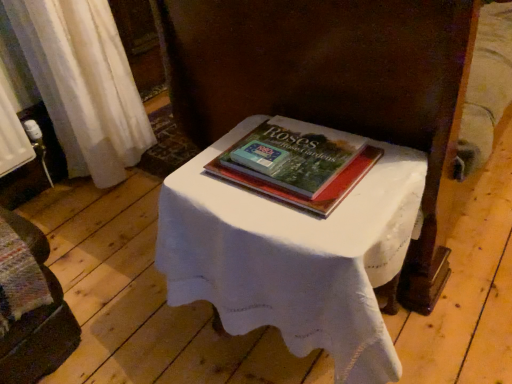
Question: Would you say wooden bench at lower left is a long distance from hardcover book at center?

Choices:
 (A) no
 (B) yes

Answer: (A)

Question: From a real-world perspective, is wooden bench at lower left over hardcover book at center?

Choices:
 (A) no
 (B) yes

Answer: (A)

Question: Could you tell me if wooden bench at lower left is turned towards hardcover book at center?

Choices:
 (A) yes
 (B) no

Answer: (B)

Question: Is wooden bench at lower left directly adjacent to hardcover book at center?

Choices:
 (A) yes
 (B) no

Answer: (B)

Question: Is hardcover book at center a part of wooden bench at lower left?

Choices:
 (A) yes
 (B) no

Answer: (B)

Question: Is hardcover book at center bigger or smaller than wooden bench at lower left?

Choices:
 (A) small
 (B) big

Answer: (A)

Question: In terms of height, does hardcover book at center look taller or shorter compared to wooden bench at lower left?

Choices:
 (A) short
 (B) tall

Answer: (A)

Question: Relative to wooden bench at lower left, is hardcover book at center in front or behind?

Choices:
 (A) behind
 (B) front

Answer: (A)

Question: Is point (335, 170) positioned closer to the camera than point (1, 238)?

Choices:
 (A) closer
 (B) farther

Answer: (A)

Question: In the image, is wooden bench at lower left on the left side or the right side of white cloth-covered table at center?

Choices:
 (A) left
 (B) right

Answer: (A)

Question: From the image's perspective, is wooden bench at lower left positioned above or below white cloth-covered table at center?

Choices:
 (A) below
 (B) above

Answer: (A)

Question: Considering the positions of wooden bench at lower left and white cloth-covered table at center in the image, is wooden bench at lower left bigger or smaller than white cloth-covered table at center?

Choices:
 (A) big
 (B) small

Answer: (B)

Question: Is point (28, 226) positioned closer to the camera than point (364, 185)?

Choices:
 (A) farther
 (B) closer

Answer: (A)

Question: From the image's perspective, is wooden bench at lower left above or below hardcover book at center?

Choices:
 (A) above
 (B) below

Answer: (B)

Question: Looking at the image, does wooden bench at lower left seem bigger or smaller compared to hardcover book at center?

Choices:
 (A) small
 (B) big

Answer: (B)